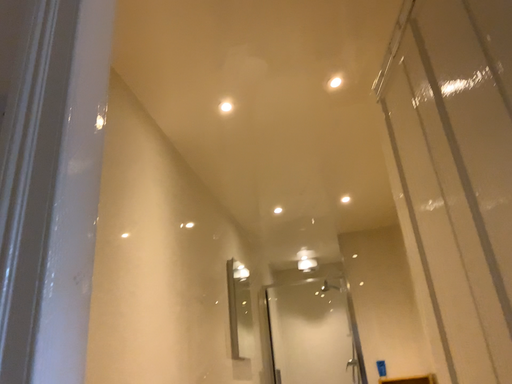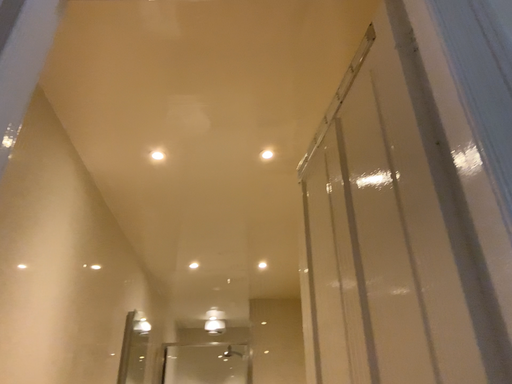
Question: Which way did the camera rotate in the video?

Choices:
 (A) rotated downward
 (B) rotated upward

Answer: (B)